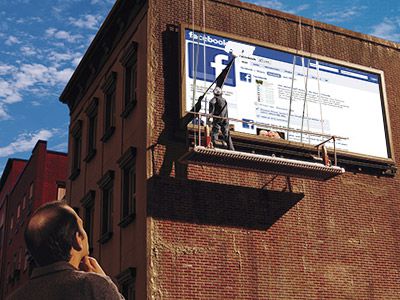
This screenshot has width=400, height=300. Identify the location of wall with windows. (127, 245).